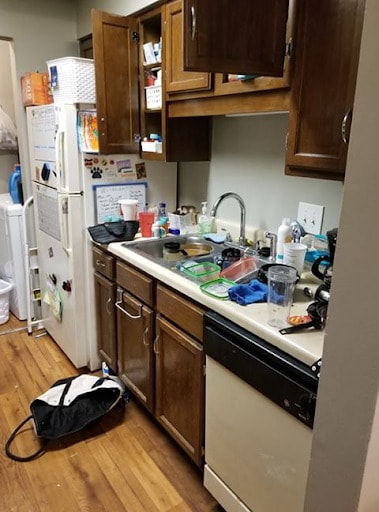
Find the location of a particular element. This screenshot has width=379, height=512. whitebaord is located at coordinates (114, 193).